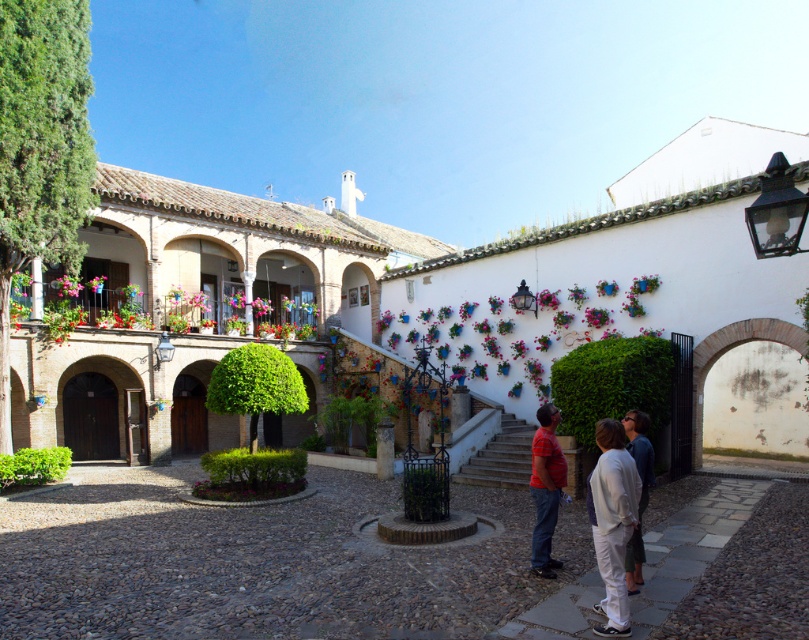
You are a guest in this courtyard and notice two shirts hanging from a clothesline in the center. Which shirt is hanging lower between the matte red shirt at center and the dark blue shirt at center?

The matte red shirt at center is positioned under the dark blue shirt at center, so it is hanging lower.

You are a visitor in this courtyard and you see the white cotton pants at lower right and the matte red shirt at center. Which one is located more to the right side of the courtyard?

The white cotton pants at lower right is positioned on the right side of matte red shirt at center, so it is more to the right side of the courtyard.